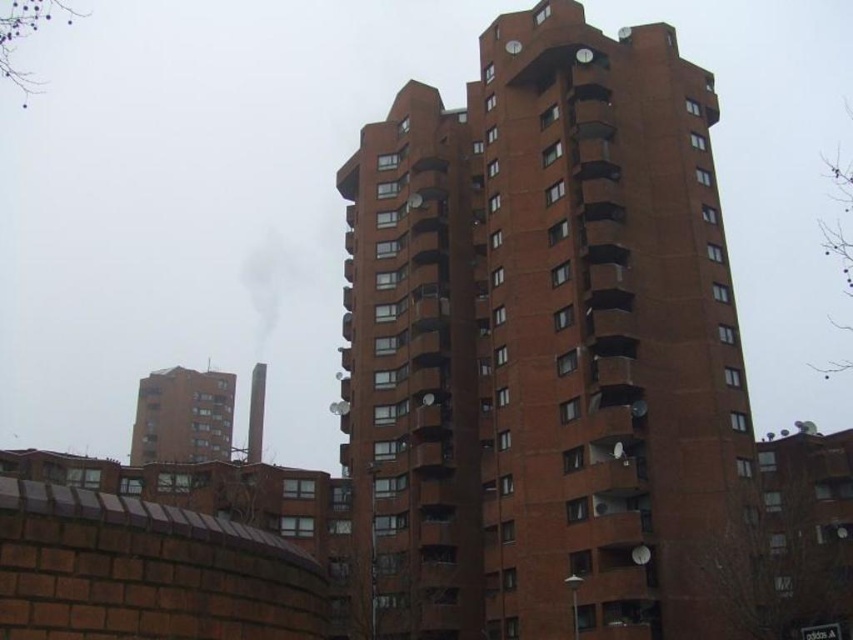
Between brick tower block at center and smooth gray chimney at center, which one is positioned higher?

brick tower block at center is above.

Who is shorter, brick tower block at center or smooth gray chimney at center?

Standing shorter between the two is smooth gray chimney at center.

I want to click on brick tower block at center, so click(543, 344).

Image resolution: width=853 pixels, height=640 pixels. Find the location of `brick tower block at center`. brick tower block at center is located at coordinates (543, 344).